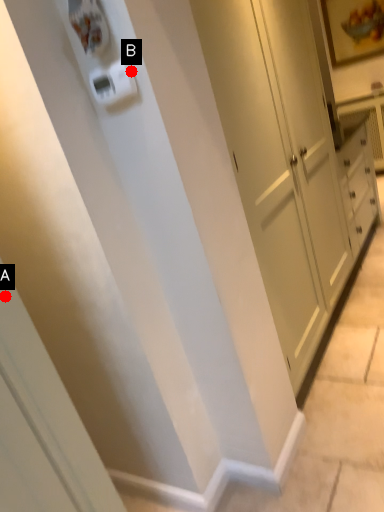
Question: Two points are circled on the image, labeled by A and B beside each circle. Which point is farther to the camera?

Choices:
 (A) A is further
 (B) B is further

Answer: (B)